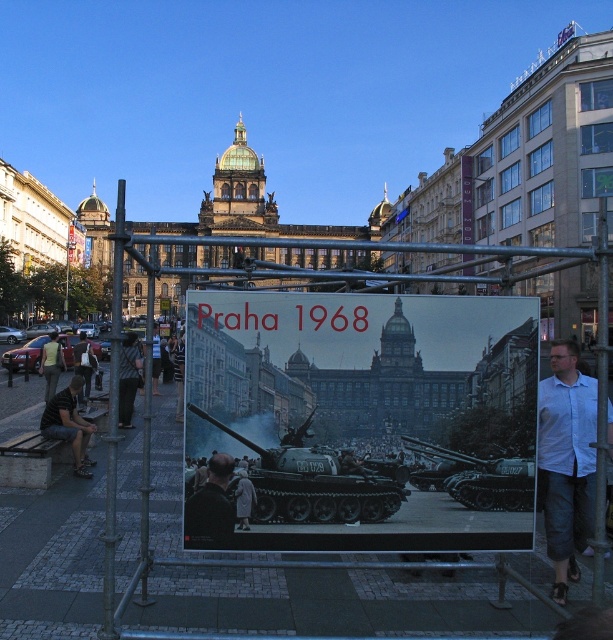
Between point (337, 506) and point (80, 360), which one is positioned in front?

Positioned in front is point (337, 506).

Who is more distant from viewer, (354,472) or (75,371)?

Positioned behind is point (75,371).

Where is `green matte tank at center`? green matte tank at center is located at coordinates (313, 483).

Who is lower down, white shirt at center right or dark gray metallic tank at center?

dark gray metallic tank at center is below.

Does white shirt at center right have a lesser width compared to dark gray metallic tank at center?

Correct, white shirt at center right's width is less than dark gray metallic tank at center's.

Between point (555, 508) and point (409, 481), which one is positioned behind?

Positioned behind is point (555, 508).

The image size is (613, 640). In order to click on white shirt at center right in this screenshot , I will do `click(566, 460)`.

Who is higher up, dark blue shirt at center or yellow shirt at left?

Positioned higher is yellow shirt at left.

How distant is dark blue shirt at center from yellow shirt at left?

dark blue shirt at center is 142.04 feet away from yellow shirt at left.

Does point (202, 541) come behind point (50, 380)?

No, it is in front of (50, 380).

Locate an element on the screen. The width and height of the screenshot is (613, 640). dark blue shirt at center is located at coordinates (210, 508).